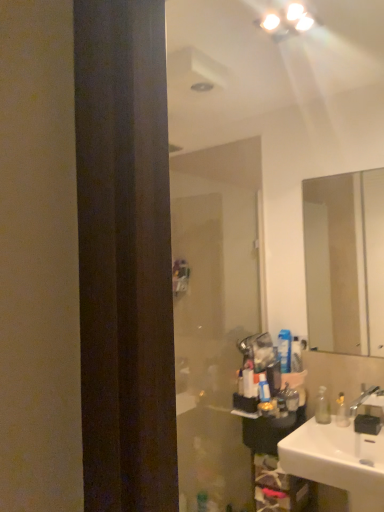
Where is `translucent plastic bottle at center, acting as the 1th toiletry starting from the left`? translucent plastic bottle at center, acting as the 1th toiletry starting from the left is located at coordinates (264, 389).

Image resolution: width=384 pixels, height=512 pixels. Describe the element at coordinates (345, 262) in the screenshot. I see `clear glass mirror at upper right` at that location.

This screenshot has height=512, width=384. Describe the element at coordinates (277, 487) in the screenshot. I see `translucent plastic shelf at lower right` at that location.

What do you see at coordinates (296, 355) in the screenshot? I see `white glossy toothpaste tube at upper right, marked as the 2th toiletry in a front-to-back arrangement` at bounding box center [296, 355].

Locate an element on the screen. Image resolution: width=384 pixels, height=512 pixels. white glossy toothpaste tube at upper right, marked as the 2th toiletry in a front-to-back arrangement is located at coordinates point(296,355).

Where is `white glossy sink at lower right`? white glossy sink at lower right is located at coordinates (338, 462).

Find the location of a particular element. The width and height of the screenshot is (384, 512). translucent plastic bottle at center, which ranks as the third toiletry in right-to-left order is located at coordinates (264, 389).

Are white plastic toothpaste tube at right, positioned as the first toiletry in back-to-front order, and clear glass mirror at upper right located far from each other?

Yes, white plastic toothpaste tube at right, positioned as the first toiletry in back-to-front order, and clear glass mirror at upper right are quite far apart.

Does point (279, 351) come in front of point (364, 286)?

Yes, point (279, 351) is closer to viewer.

Which object is closer to the camera, white plastic toothpaste tube at right, the third toiletry in the front-to-back sequence, or clear glass mirror at upper right?

Positioned in front is clear glass mirror at upper right.

From a real-world perspective, which is physically below, white plastic toothpaste tube at right, positioned as the 2th toiletry in left-to-right order, or clear glass mirror at upper right?

white plastic toothpaste tube at right, positioned as the 2th toiletry in left-to-right order.

Does point (282, 333) come behind point (326, 399)?

Yes, point (282, 333) is farther from viewer.

How many degrees apart are the facing directions of white plastic toothpaste tube at right, positioned as the 2th toiletry in left-to-right order, and transparent plastic bottle at right?

The angular difference between white plastic toothpaste tube at right, positioned as the 2th toiletry in left-to-right order, and transparent plastic bottle at right is 0.00186 degrees.

Based on the photo, considering the relative positions of white plastic toothpaste tube at right, acting as the 2th toiletry starting from the right, and transparent plastic bottle at right in the image provided, is white plastic toothpaste tube at right, acting as the 2th toiletry starting from the right, in front of transparent plastic bottle at right?

No.

From their relative heights in the image, would you say white plastic toothpaste tube at right, positioned as the first toiletry in back-to-front order, is taller or shorter than transparent plastic bottle at right?

Clearly, white plastic toothpaste tube at right, positioned as the first toiletry in back-to-front order, is taller compared to transparent plastic bottle at right.

Looking at this image, considering the relative sizes of white glossy toothpaste tube at upper right, which is the 1th toiletry from right to left, and silver metallic faucet at lower right in the image provided, is white glossy toothpaste tube at upper right, which is the 1th toiletry from right to left, wider than silver metallic faucet at lower right?

No, white glossy toothpaste tube at upper right, which is the 1th toiletry from right to left, is not wider than silver metallic faucet at lower right.

From a real-world perspective, which is physically above, white glossy toothpaste tube at upper right, which is the 1th toiletry from right to left, or silver metallic faucet at lower right?

white glossy toothpaste tube at upper right, which is the 1th toiletry from right to left, is physically above.

This screenshot has width=384, height=512. I want to click on the 2nd toiletry positioned above the silver metallic faucet at lower right (from the image's perspective), so pos(296,355).

Considering the positions of objects translucent plastic bottle at center, which is the 1th toiletry in front-to-back order, and transparent plastic screen door at center in the image provided, who is behind, translucent plastic bottle at center, which is the 1th toiletry in front-to-back order, or transparent plastic screen door at center?

Positioned behind is transparent plastic screen door at center.

From a real-world perspective, which is physically below, translucent plastic bottle at center, which is the 1th toiletry in front-to-back order, or transparent plastic screen door at center?

From a 3D spatial view, translucent plastic bottle at center, which is the 1th toiletry in front-to-back order, is below.

Considering the relative sizes of translucent plastic bottle at center, acting as the 1th toiletry starting from the left, and transparent plastic screen door at center in the image provided, is translucent plastic bottle at center, acting as the 1th toiletry starting from the left, taller than transparent plastic screen door at center?

No.

Would you consider translucent plastic bottle at center, which ranks as the third toiletry in right-to-left order, to be distant from transparent plastic screen door at center?

No, translucent plastic bottle at center, which ranks as the third toiletry in right-to-left order, is not far away from transparent plastic screen door at center.

Is clear glass mirror at upper right turned away from white plastic toothpaste tube at right, positioned as the 2th toiletry in left-to-right order?

No, clear glass mirror at upper right is not facing the opposite direction of white plastic toothpaste tube at right, positioned as the 2th toiletry in left-to-right order.

From the image's perspective, which object appears higher, clear glass mirror at upper right or white plastic toothpaste tube at right, acting as the 2th toiletry starting from the right?

clear glass mirror at upper right appears higher in the image.

Looking at the image, does clear glass mirror at upper right seem bigger or smaller compared to white plastic toothpaste tube at right, positioned as the 2th toiletry in left-to-right order?

Considering their sizes, clear glass mirror at upper right takes up more space than white plastic toothpaste tube at right, positioned as the 2th toiletry in left-to-right order.

From a real-world perspective, which is physically below, translucent plastic shelf at lower right or clear glass mirror at upper right?

translucent plastic shelf at lower right is physically lower.

Between translucent plastic shelf at lower right and clear glass mirror at upper right, which one is positioned in front?

translucent plastic shelf at lower right.

Between translucent plastic shelf at lower right and clear glass mirror at upper right, which one appears on the right side from the viewer's perspective?

clear glass mirror at upper right is more to the right.

From the image's perspective, would you say translucent plastic shelf at lower right is shown under clear glass mirror at upper right?

Indeed, from the image's perspective, translucent plastic shelf at lower right is shown beneath clear glass mirror at upper right.

From the image's perspective, would you say white glossy toothpaste tube at upper right, which is the 1th toiletry from right to left, is positioned over white glossy sink at lower right?

Yes.

Is white glossy toothpaste tube at upper right, which appears as the 3th toiletry when viewed from the left, at the right side of white glossy sink at lower right?

No.

Are white glossy toothpaste tube at upper right, marked as the 2th toiletry in a front-to-back arrangement, and white glossy sink at lower right far apart?

That's not correct — white glossy toothpaste tube at upper right, marked as the 2th toiletry in a front-to-back arrangement, is a little close to white glossy sink at lower right.

From the image's perspective, which toiletry is the 1st one below the clear glass mirror at upper right? Please provide its 2D coordinates.

[(284, 350)]

The width and height of the screenshot is (384, 512). In order to click on the 2nd toiletry to the left of the transparent plastic bottle at right, counting from the anchor's position in this screenshot , I will do `click(284, 350)`.

Estimate the real-world distances between objects in this image. Which object is further from transparent plastic bottle at right, white glossy toothpaste tube at upper right, marked as the 2th toiletry in a front-to-back arrangement, or translucent plastic bottle at center, which is counted as the third toiletry, starting from the back?

Among the two, translucent plastic bottle at center, which is counted as the third toiletry, starting from the back, is located further to transparent plastic bottle at right.

Looking at the image, which one is located further to silver metallic faucet at lower right, transparent plastic screen door at center or white plastic toothpaste tube at right, acting as the 2th toiletry starting from the right?

transparent plastic screen door at center.

From the image, which object appears to be nearer to white plastic toothpaste tube at right, positioned as the 2th toiletry in left-to-right order, white glossy sink at lower right or clear glass mirror at upper right?

The object closer to white plastic toothpaste tube at right, positioned as the 2th toiletry in left-to-right order, is white glossy sink at lower right.

Based on the photo, when comparing their distances from translucent plastic bottle at center, which is the 1th toiletry in front-to-back order, does white plastic toothpaste tube at right, positioned as the first toiletry in back-to-front order, or silver metallic faucet at lower right seem further?

silver metallic faucet at lower right lies further to translucent plastic bottle at center, which is the 1th toiletry in front-to-back order, than the other object.

When comparing their distances from white glossy light fixture at upper center, does white glossy sink at lower right or clear glass mirror at upper right seem closer?

white glossy sink at lower right is positioned closer to the anchor white glossy light fixture at upper center.

In the scene shown: Looking at the image, which one is located further to white glossy toothpaste tube at upper right, which appears as the 3th toiletry when viewed from the left, white glossy light fixture at upper center or white plastic toothpaste tube at right, acting as the 2th toiletry starting from the right?

Based on the image, white glossy light fixture at upper center appears to be further to white glossy toothpaste tube at upper right, which appears as the 3th toiletry when viewed from the left.

From the picture: Looking at the image, which one is located further to silver metallic faucet at lower right, clear glass mirror at upper right or transparent plastic screen door at center?

The object further to silver metallic faucet at lower right is clear glass mirror at upper right.

When comparing their distances from transparent plastic screen door at center, does transparent plastic bottle at right or clear glass mirror at upper right seem further?

clear glass mirror at upper right lies further to transparent plastic screen door at center than the other object.

The width and height of the screenshot is (384, 512). Find the location of `toiletry between white glossy toothpaste tube at upper right, marked as the 2th toiletry in a front-to-back arrangement, and translucent plastic shelf at lower right vertically`. toiletry between white glossy toothpaste tube at upper right, marked as the 2th toiletry in a front-to-back arrangement, and translucent plastic shelf at lower right vertically is located at coordinates (264, 389).

Identify the location of tap located between white glossy sink at lower right and white glossy toothpaste tube at upper right, which is the 1th toiletry from right to left, in the depth direction. This screenshot has height=512, width=384. (369, 401).

Identify the location of sink between white glossy light fixture at upper center and translucent plastic shelf at lower right in the up-down direction. The width and height of the screenshot is (384, 512). (338, 462).

Where is `screen door between clear glass mirror at upper right and white glossy sink at lower right in the vertical direction`? This screenshot has width=384, height=512. screen door between clear glass mirror at upper right and white glossy sink at lower right in the vertical direction is located at coordinates (214, 313).